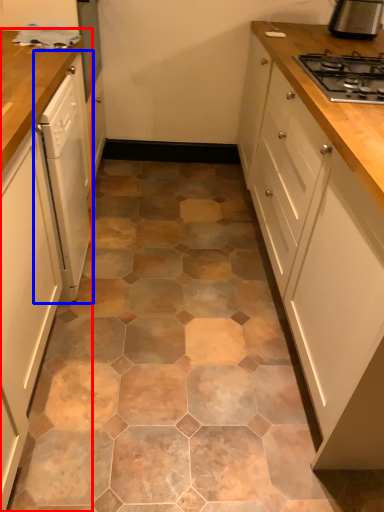
Question: Which point is closer to the camera, cabinetry (highlighted by a red box) or home appliance (highlighted by a blue box)?

Choices:
 (A) cabinetry
 (B) home appliance

Answer: (A)